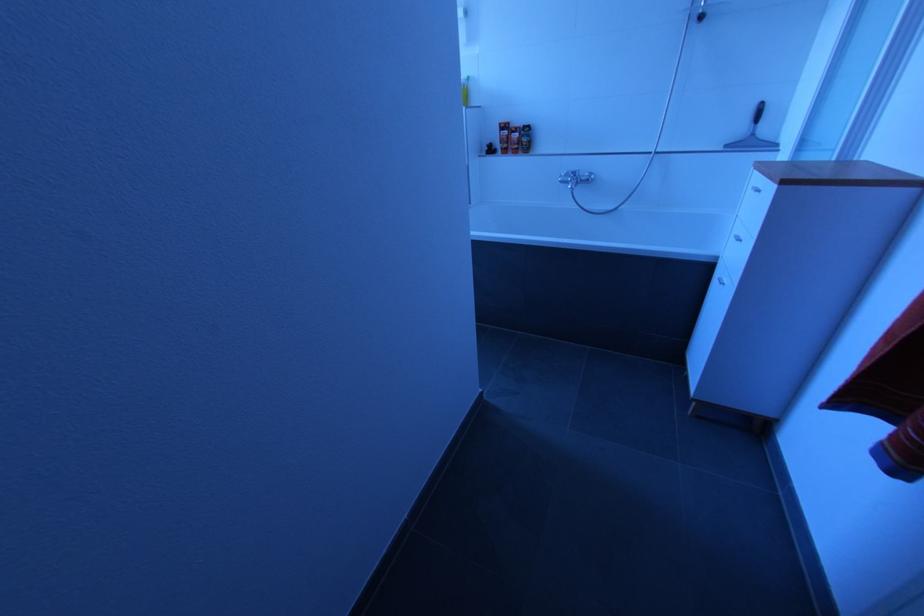
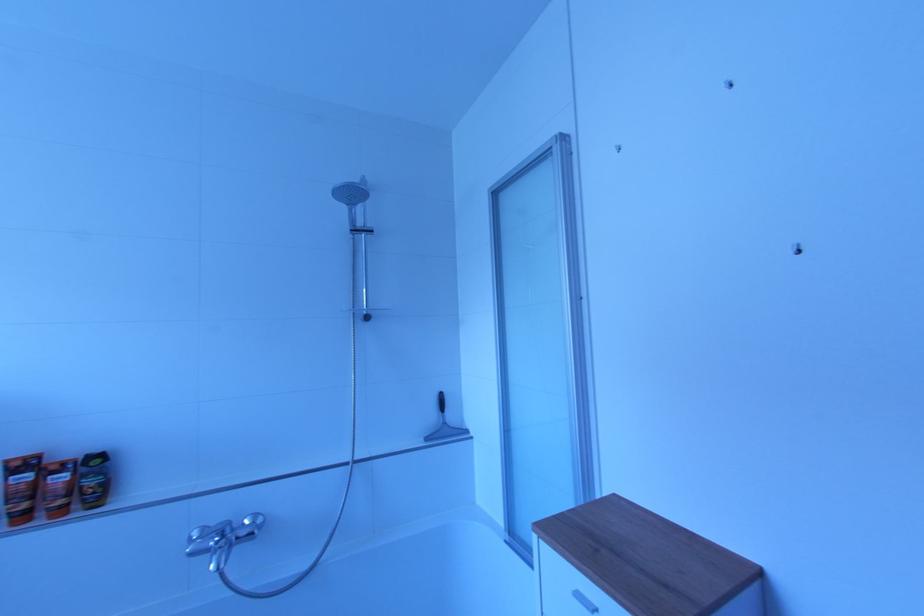
Based on the continuous images, in which direction is the camera rotating?

The camera's rotation is toward right-up.